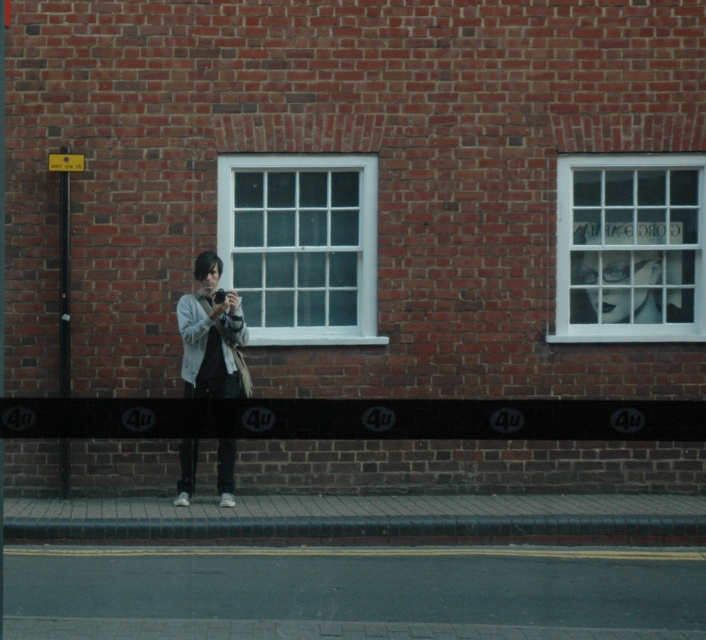
You are a photographer trying to capture the scene from the front. Since the matte gray jacket at center and the white glass window at center are both in your view, which object will appear closer to you in the photograph?

The white glass window at center will appear closer to you in the photograph because the matte gray jacket at center is behind it.

You are standing at point (189, 540) and want to walk to the brick wall. Is the point (698, 164) between you and the wall?

Yes, the point (698, 164) is between you and the brick wall because it is behind point (189, 540) where you are standing.